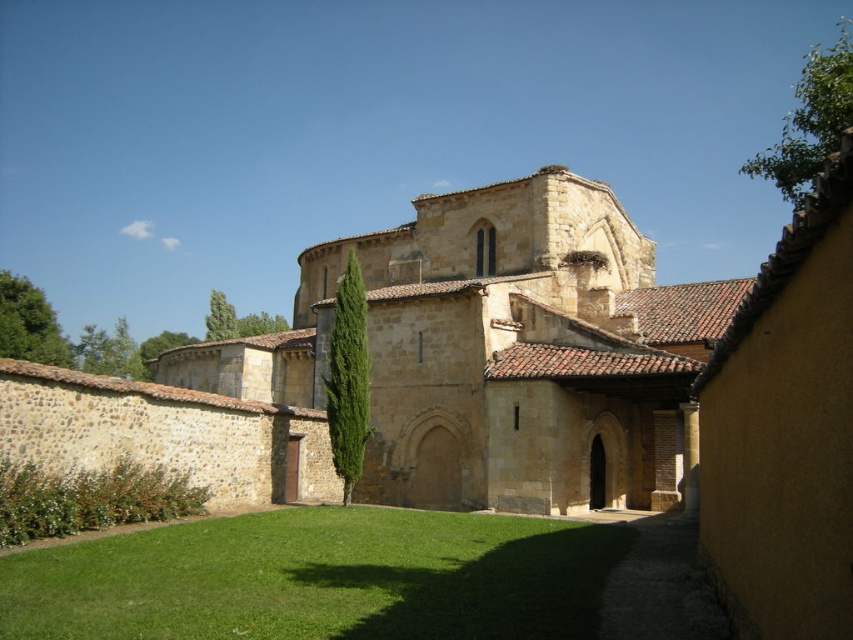
Does beige stone chapel at center have a larger size compared to green grass at center?

Indeed, beige stone chapel at center has a larger size compared to green grass at center.

Is point (544, 400) closer to viewer compared to point (381, 579)?

No, it is behind (381, 579).

Image resolution: width=853 pixels, height=640 pixels. Find the location of `beige stone chapel at center`. beige stone chapel at center is located at coordinates (498, 353).